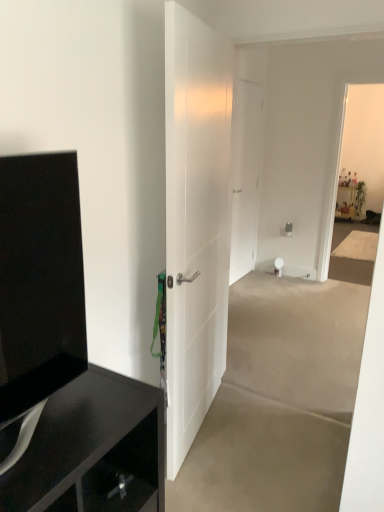
Question: From a real-world perspective, is white matte door at center, the first door when ordered from right to left, located higher than white smooth door at center, which is the 2th door in back-to-front order?

Choices:
 (A) yes
 (B) no

Answer: (A)

Question: Is white matte door at center, the first door when ordered from right to left, outside of white smooth door at center, the first door in the left-to-right sequence?

Choices:
 (A) no
 (B) yes

Answer: (B)

Question: Can you confirm if white matte door at center, the first door when ordered from right to left, is positioned to the right of white smooth door at center, which is the 2th door in back-to-front order?

Choices:
 (A) yes
 (B) no

Answer: (A)

Question: From the image's perspective, would you say white matte door at center, which is counted as the 2th door, starting from the front, is shown under white smooth door at center, arranged as the second door when viewed from the right?

Choices:
 (A) yes
 (B) no

Answer: (B)

Question: Can you confirm if white matte door at center, the first door when ordered from right to left, is shorter than white smooth door at center, which is the 2th door in back-to-front order?

Choices:
 (A) no
 (B) yes

Answer: (B)

Question: In the image, is black glossy cabinet at left positioned in front of or behind white matte door at center, which is counted as the 2th door, starting from the front?

Choices:
 (A) behind
 (B) front

Answer: (B)

Question: Is black glossy cabinet at left situated inside white matte door at center, which is the second door from left to right, or outside?

Choices:
 (A) inside
 (B) outside

Answer: (B)

Question: From a real-world perspective, relative to white matte door at center, which is the first door from back to front, is black glossy cabinet at left vertically above or below?

Choices:
 (A) below
 (B) above

Answer: (A)

Question: Is point (34, 494) closer or farther from the camera than point (235, 245)?

Choices:
 (A) farther
 (B) closer

Answer: (B)

Question: Is black glossy tv cabinet at left to the left or to the right of white matte door at center, the first door when ordered from right to left, in the image?

Choices:
 (A) left
 (B) right

Answer: (A)

Question: Considering their positions, is black glossy tv cabinet at left located in front of or behind white matte door at center, which is the second door from left to right?

Choices:
 (A) front
 (B) behind

Answer: (A)

Question: From the image's perspective, is black glossy tv cabinet at left located above or below white matte door at center, the first door when ordered from right to left?

Choices:
 (A) above
 (B) below

Answer: (B)

Question: Considering the positions of black glossy tv cabinet at left and white matte door at center, which is the first door from back to front, in the image, is black glossy tv cabinet at left wider or thinner than white matte door at center, which is the first door from back to front,?

Choices:
 (A) wide
 (B) thin

Answer: (A)

Question: Considering the positions of black glossy tv cabinet at left and black glossy cabinet at left in the image, is black glossy tv cabinet at left bigger or smaller than black glossy cabinet at left?

Choices:
 (A) big
 (B) small

Answer: (B)

Question: From a real-world perspective, relative to black glossy cabinet at left, is black glossy tv cabinet at left vertically above or below?

Choices:
 (A) above
 (B) below

Answer: (A)